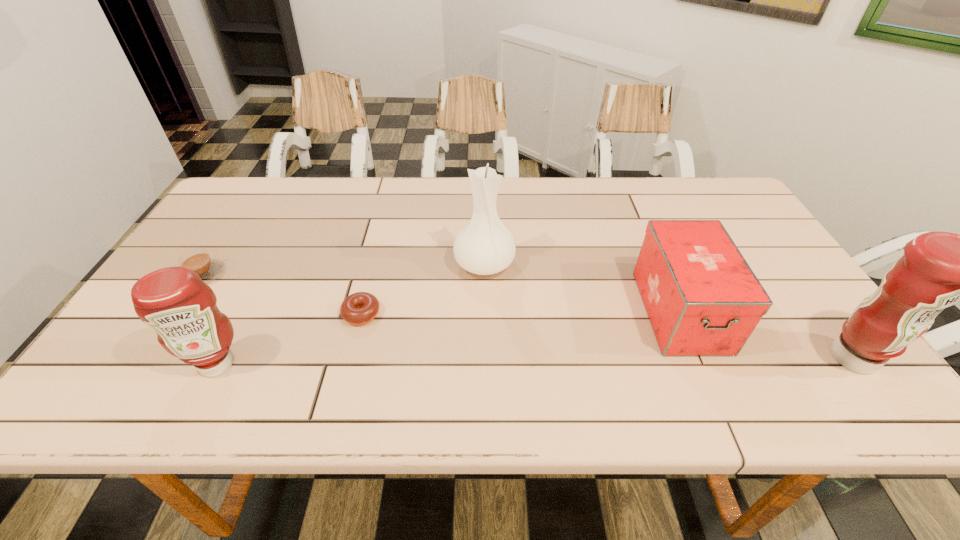
Where is `the fifth tallest object`? the fifth tallest object is located at coordinates (198, 260).

The image size is (960, 540). I want to click on free space located on the right of the left condiment, so click(x=339, y=363).

Find the location of a particular element. free space located on the left of the right condiment is located at coordinates (640, 357).

This screenshot has height=540, width=960. In order to click on free region located on the front of the fourth object from left to right in this screenshot , I will do `click(485, 299)`.

Identify the location of free space located on the back of the shortest object. The image size is (960, 540). (381, 237).

Locate an element on the screen. This screenshot has width=960, height=540. free space located 0.360m on the right of the leftmost object is located at coordinates (362, 274).

Where is `the first-aid kit that is at the near edge`? Image resolution: width=960 pixels, height=540 pixels. the first-aid kit that is at the near edge is located at coordinates (702, 298).

In order to click on object at the left edge in this screenshot , I will do `click(198, 260)`.

Locate an element on the screen. This screenshot has width=960, height=540. object that is at the right edge is located at coordinates (938, 269).

Identify the location of object that is at the near right corner. The image size is (960, 540). (938, 269).